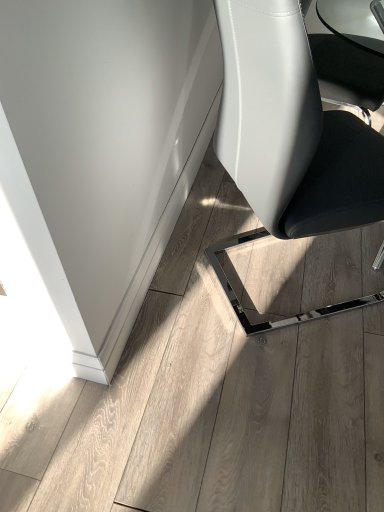
You are a GUI agent. You are given a task and a screenshot of the screen. Output one action in this format:
    pyautogui.click(x=<x>, y=<y>)
    Task: Click on the vacant area that is in front of white leather chair at center
    The width and height of the screenshot is (384, 512).
    Given the screenshot: What is the action you would take?
    pyautogui.click(x=287, y=392)